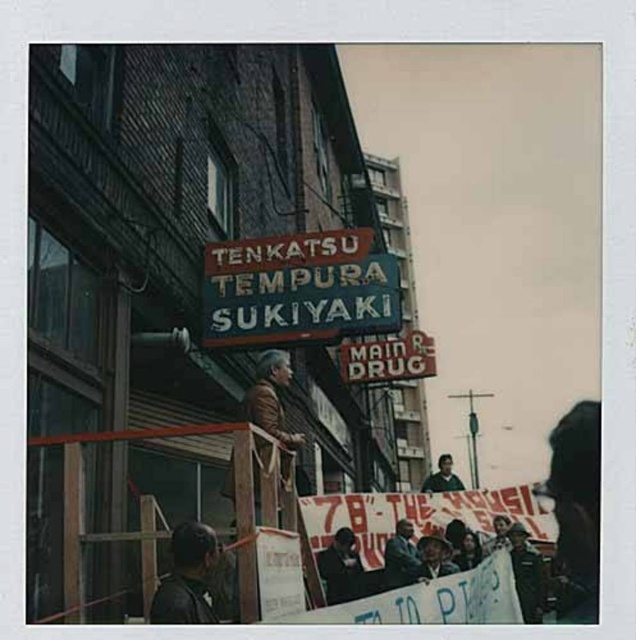
The height and width of the screenshot is (640, 636). What do you see at coordinates (401, 556) in the screenshot?
I see `dark green jacket at center` at bounding box center [401, 556].

Who is more forward, (403, 536) or (448, 468)?

Point (403, 536) is in front.

Locate an element on the screen. This screenshot has height=640, width=636. dark green jacket at center is located at coordinates (401, 556).

Is dark green uniform at center bigger than dark green jacket at center?

Correct, dark green uniform at center is larger in size than dark green jacket at center.

Does dark green uniform at center appear on the left side of dark green jacket at center?

In fact, dark green uniform at center is to the right of dark green jacket at center.

Is point (516, 566) more distant than point (401, 532)?

That is True.

Locate an element on the screen. dark green uniform at center is located at coordinates (527, 573).

Is dark brown leather jacket at lower left to the right of smooth black shirt at center from the viewer's perspective?

Incorrect, dark brown leather jacket at lower left is not on the right side of smooth black shirt at center.

Between dark brown leather jacket at lower left and smooth black shirt at center, which one appears on the left side from the viewer's perspective?

From the viewer's perspective, dark brown leather jacket at lower left appears more on the left side.

Is point (188, 556) closer to viewer compared to point (455, 484)?

Yes, it is in front of point (455, 484).

The width and height of the screenshot is (636, 640). Find the location of `dark brown leather jacket at lower left`. dark brown leather jacket at lower left is located at coordinates (186, 577).